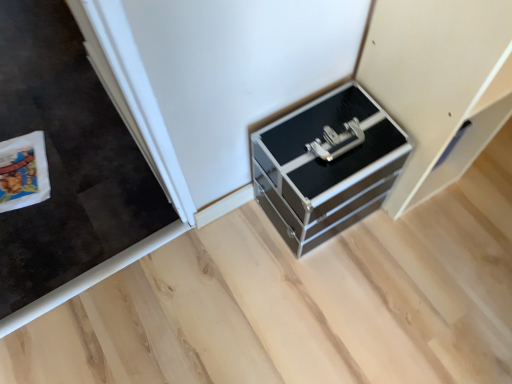
The image size is (512, 384). I want to click on vacant point to the right of metallic black chest of drawers at center, so click(411, 242).